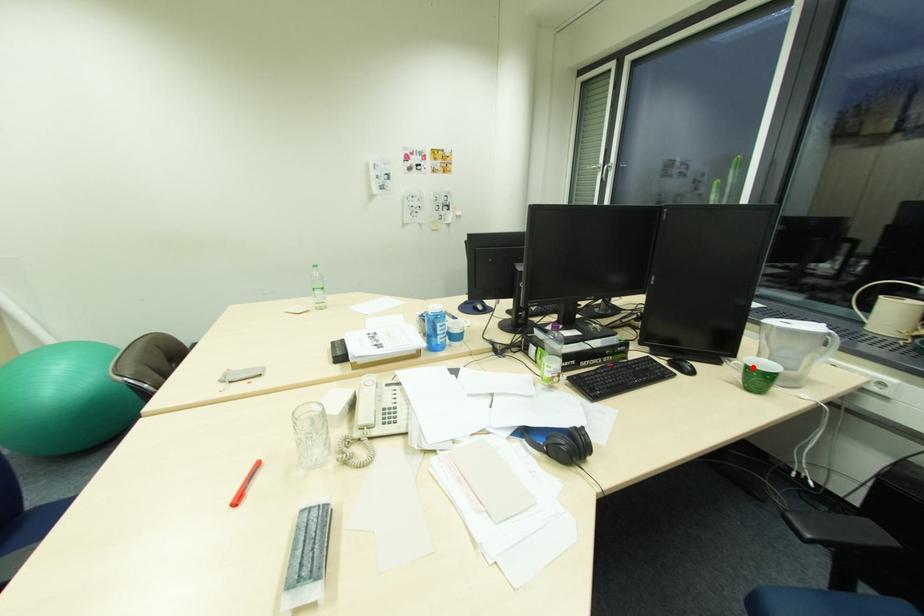
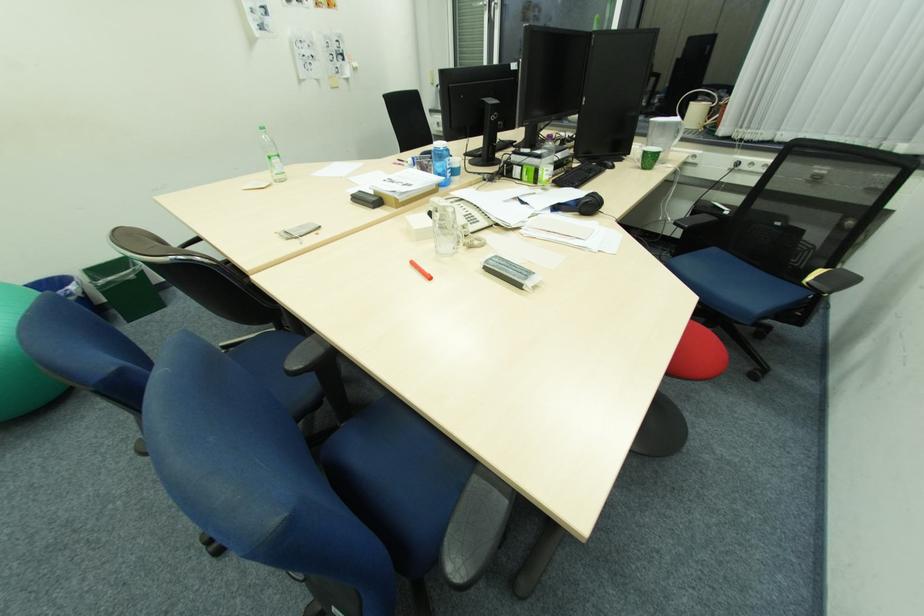
Question: I am providing you with two images of the same scene from different viewpoints. A red point is shown in image1. For the corresponding object point in image2, is it positioned nearer or farther from the camera?

Choices:
 (A) Nearer
 (B) Farther

Answer: (A)